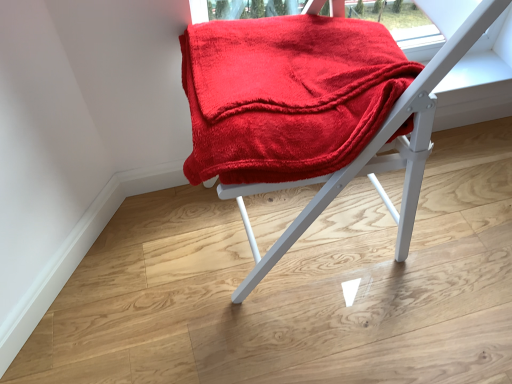
Identify the location of vacant space to the right of fuzzy red blanket at center. The height and width of the screenshot is (384, 512). (451, 241).